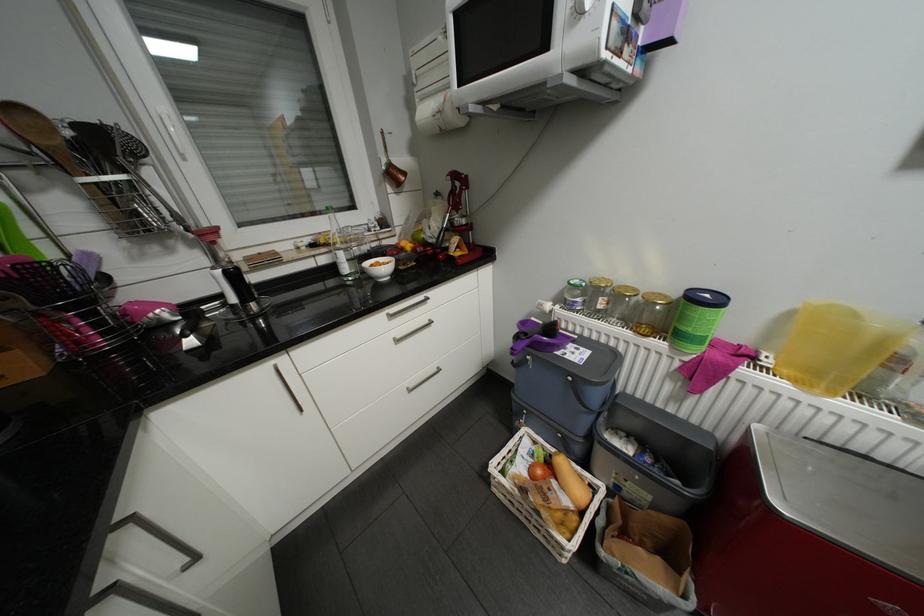
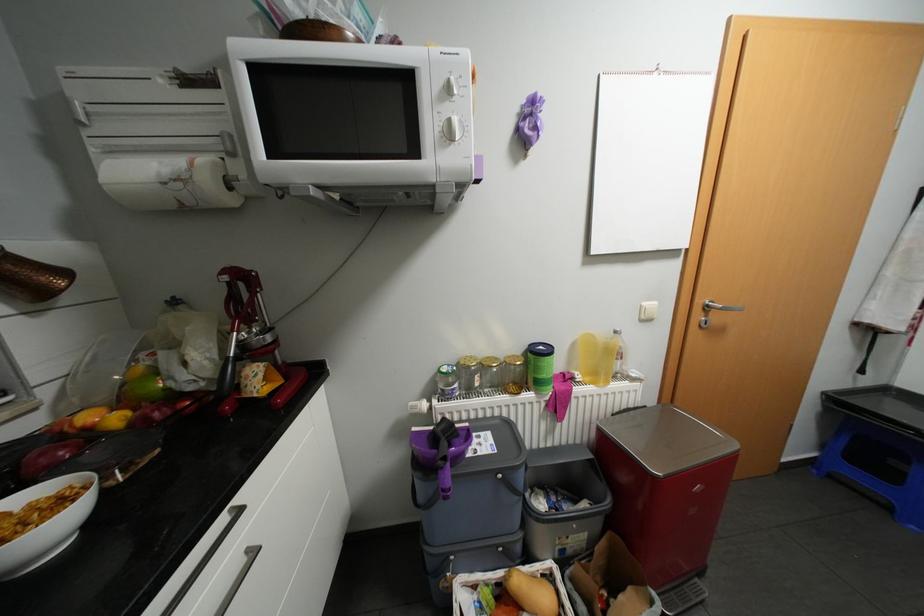
The point at (775, 361) is marked in the first image. Where is the corresponding point in the second image?

(587, 377)